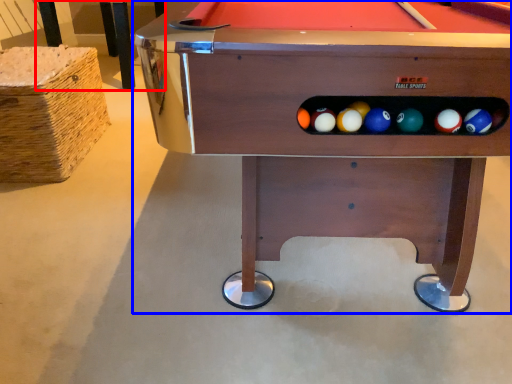
Question: Which object is closer to the camera taking this photo, table (highlighted by a red box) or billiard table (highlighted by a blue box)?

Choices:
 (A) table
 (B) billiard table

Answer: (B)